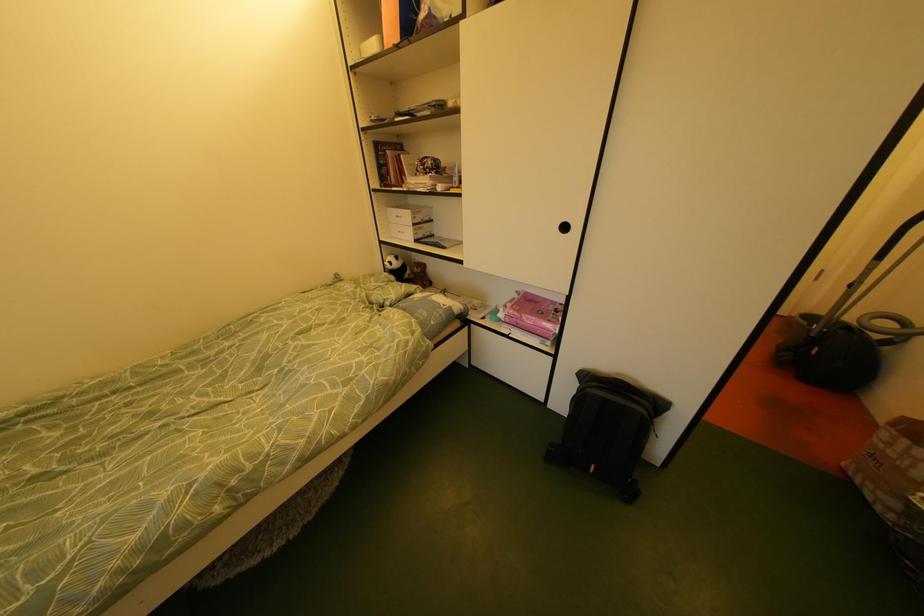
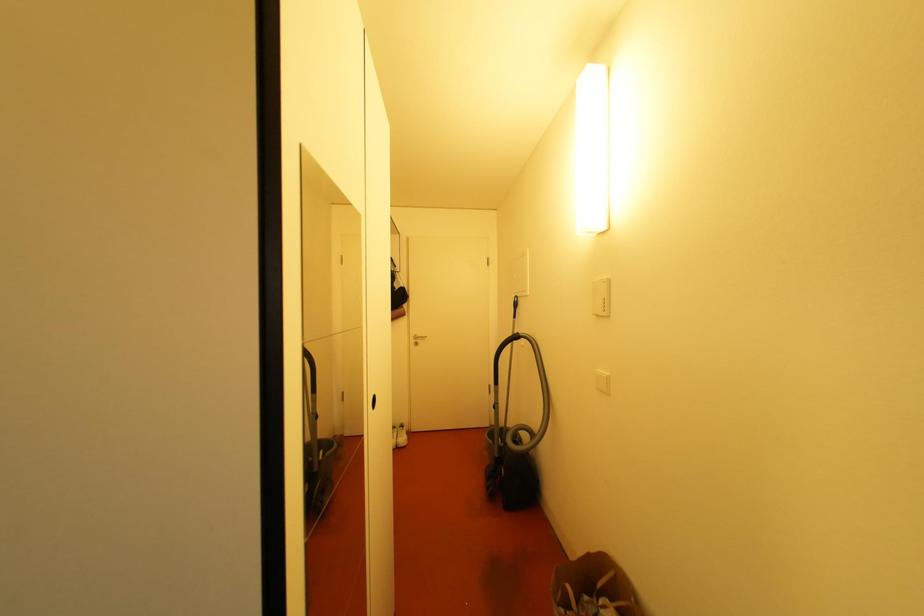
How did the camera likely rotate?

The rotation direction of the camera is right-up.